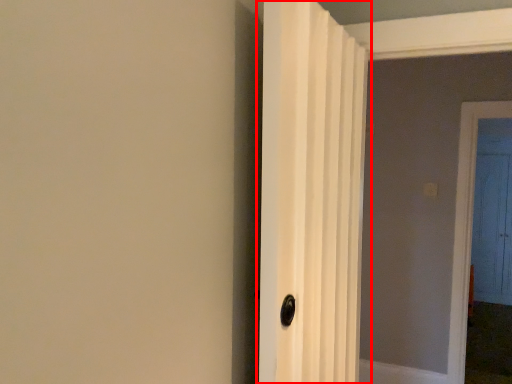
Question: Observing the image, what is the correct spatial positioning of door (annotated by the red box) in reference to door?

Choices:
 (A) left
 (B) right

Answer: (A)